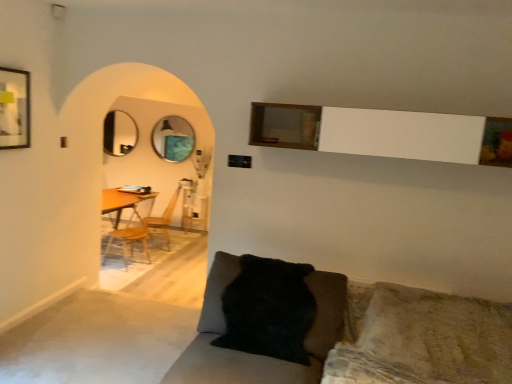
Locate an element on the screen. matte black picture frame at upper left is located at coordinates (14, 109).

The height and width of the screenshot is (384, 512). What do you see at coordinates (119, 133) in the screenshot?
I see `matte silver mirror at left, placed as the first mirror when sorted from left to right` at bounding box center [119, 133].

The width and height of the screenshot is (512, 384). Find the location of `matte black picture frame at upper left`. matte black picture frame at upper left is located at coordinates (14, 109).

Is point (132, 121) farther from viewer compared to point (289, 321)?

Yes, it is.

Consider the image. Which object is thinner, matte silver mirror at left, which is the second mirror from right to left, or black fuzzy pillow at lower center?

Thinner between the two is matte silver mirror at left, which is the second mirror from right to left.

Does matte silver mirror at left, which is the second mirror from right to left, turn towards black fuzzy pillow at lower center?

No, matte silver mirror at left, which is the second mirror from right to left, is not facing towards black fuzzy pillow at lower center.

Would you say black fuzzy pillow at lower center is part of matte silver mirror at left, which is the second mirror from right to left,'s contents?

No, matte silver mirror at left, which is the second mirror from right to left, does not contain black fuzzy pillow at lower center.

In terms of size, does black fuzzy pillow at lower center appear bigger or smaller than wooden armchair at center?

Considering their sizes, black fuzzy pillow at lower center takes up less space than wooden armchair at center.

Is black fuzzy pillow at lower center completely or partially outside of wooden armchair at center?

Absolutely, black fuzzy pillow at lower center is external to wooden armchair at center.

Based on the photo, is black fuzzy pillow at lower center facing towards wooden armchair at center?

No, black fuzzy pillow at lower center does not turn towards wooden armchair at center.

What are the coordinates of `pillow positioned vertically above the wooden armchair at center (from a real-world perspective)` in the screenshot? It's located at (268, 309).

Is black fuzzy pillow at lower center in front of matte silver mirror at left, which is the second mirror from right to left?

Yes, black fuzzy pillow at lower center is closer to the viewer.

From a real-world perspective, is black fuzzy pillow at lower center located beneath matte silver mirror at left, placed as the first mirror when sorted from left to right?

Yes, from a real-world perspective, black fuzzy pillow at lower center is beneath matte silver mirror at left, placed as the first mirror when sorted from left to right.

How many degrees apart are the facing directions of black fuzzy pillow at lower center and matte silver mirror at left, which is the second mirror from right to left?

There is a 0.769-degree angle between the facing directions of black fuzzy pillow at lower center and matte silver mirror at left, which is the second mirror from right to left.

Is matte black picture frame at upper left situated inside matte silver mirror at left, placed as the first mirror when sorted from left to right, or outside?

matte black picture frame at upper left is outside matte silver mirror at left, placed as the first mirror when sorted from left to right.

Is matte silver mirror at left, placed as the first mirror when sorted from left to right, at the back of matte black picture frame at upper left?

No, matte black picture frame at upper left is not facing away from matte silver mirror at left, placed as the first mirror when sorted from left to right.

Between matte black picture frame at upper left and matte silver mirror at left, placed as the first mirror when sorted from left to right, which one has smaller size?

Smaller between the two is matte black picture frame at upper left.

Looking at this image, can you tell me how much wooden at left and wooden armchair at center differ in facing direction?

There is a 42.9-degree angle between the facing directions of wooden at left and wooden armchair at center.

Which object is thinner, wooden at left or wooden armchair at center?

With smaller width is wooden armchair at center.

From the image's perspective, does wooden at left appear lower than wooden armchair at center?

Yes.

From the image's perspective, which is above, wooden armchair at center or matte silver mirror at left, placed as the first mirror when sorted from left to right?

From the image's view, matte silver mirror at left, placed as the first mirror when sorted from left to right, is above.

Considering the positions of objects wooden armchair at center and matte silver mirror at left, placed as the first mirror when sorted from left to right, in the image provided, who is behind, wooden armchair at center or matte silver mirror at left, placed as the first mirror when sorted from left to right,?

matte silver mirror at left, placed as the first mirror when sorted from left to right.

From a real-world perspective, does wooden armchair at center sit lower than matte silver mirror at left, placed as the first mirror when sorted from left to right?

Indeed, from a real-world perspective, wooden armchair at center is positioned beneath matte silver mirror at left, placed as the first mirror when sorted from left to right.

Which is more to the left, wooden armchair at center or matte silver mirror at left, which is the second mirror from right to left?

Positioned to the left is matte silver mirror at left, which is the second mirror from right to left.

Considering the relative sizes of matte silver mirror at left, which is the second mirror from right to left, and wooden armchair at center in the image provided, is matte silver mirror at left, which is the second mirror from right to left, smaller than wooden armchair at center?

Indeed, matte silver mirror at left, which is the second mirror from right to left, has a smaller size compared to wooden armchair at center.

Consider the image. Is matte silver mirror at left, which is the second mirror from right to left, not near wooden armchair at center?

matte silver mirror at left, which is the second mirror from right to left, is far away from wooden armchair at center.

Does point (129, 123) lie behind point (180, 188)?

No.

Where is `pillow that appears below the matte silver mirror at left, which is the second mirror from right to left (from a real-world perspective)`? The height and width of the screenshot is (384, 512). pillow that appears below the matte silver mirror at left, which is the second mirror from right to left (from a real-world perspective) is located at coordinates (268, 309).

At what (x,y) coordinates should I click in order to perform the action: click on pillow that is above the wooden armchair at center (from a real-world perspective). Please return your answer as a coordinate pair (x, y). The height and width of the screenshot is (384, 512). Looking at the image, I should click on (268, 309).

When comparing their distances from matte silver mirror at left, which is the second mirror from right to left, does wooden armchair at center or black fuzzy pillow at lower center seem further?

Based on the image, black fuzzy pillow at lower center appears to be further to matte silver mirror at left, which is the second mirror from right to left.

Based on their spatial positions, is wooden at left or black fuzzy pillow at lower center closer to wooden armchair at center?

wooden at left.

Considering their positions, is wooden at left positioned closer to metallic circular mirror at center, the first mirror from the right, than matte silver mirror at left, placed as the first mirror when sorted from left to right?

Based on the image, matte silver mirror at left, placed as the first mirror when sorted from left to right, appears to be nearer to metallic circular mirror at center, the first mirror from the right.

Based on their spatial positions, is matte silver mirror at left, which is the second mirror from right to left, or matte black picture frame at upper left closer to metallic circular mirror at center, the first mirror from the right?

Among the two, matte silver mirror at left, which is the second mirror from right to left, is located nearer to metallic circular mirror at center, the first mirror from the right.

Considering their positions, is metallic circular mirror at center, arranged as the second mirror when viewed from the left, positioned closer to wooden armchair at center than matte silver mirror at left, placed as the first mirror when sorted from left to right?

metallic circular mirror at center, arranged as the second mirror when viewed from the left, is positioned closer to the anchor wooden armchair at center.

Which object lies further to the anchor point black fuzzy pillow at lower center, matte silver mirror at left, placed as the first mirror when sorted from left to right, or metallic circular mirror at center, the first mirror from the right?

matte silver mirror at left, placed as the first mirror when sorted from left to right.

Which object lies nearer to the anchor point wooden at left, wooden armchair at center or matte black picture frame at upper left?

wooden armchair at center is closer to wooden at left.

Which object lies nearer to the anchor point black fuzzy pillow at lower center, metallic circular mirror at center, arranged as the second mirror when viewed from the left, or matte black picture frame at upper left?

Based on the image, matte black picture frame at upper left appears to be nearer to black fuzzy pillow at lower center.

Locate an element on the screen. mirror located between matte black picture frame at upper left and matte silver mirror at left, placed as the first mirror when sorted from left to right, in the depth direction is located at coordinates (x=173, y=139).

Identify the location of chair between matte black picture frame at upper left and metallic circular mirror at center, arranged as the second mirror when viewed from the left, in the front-back direction. (129, 235).

In order to click on chair between matte black picture frame at upper left and wooden armchair at center in the front-back direction in this screenshot , I will do `click(129, 235)`.

This screenshot has height=384, width=512. In order to click on chair positioned between black fuzzy pillow at lower center and metallic circular mirror at center, arranged as the second mirror when viewed from the left, from near to far in this screenshot , I will do `click(129, 235)`.